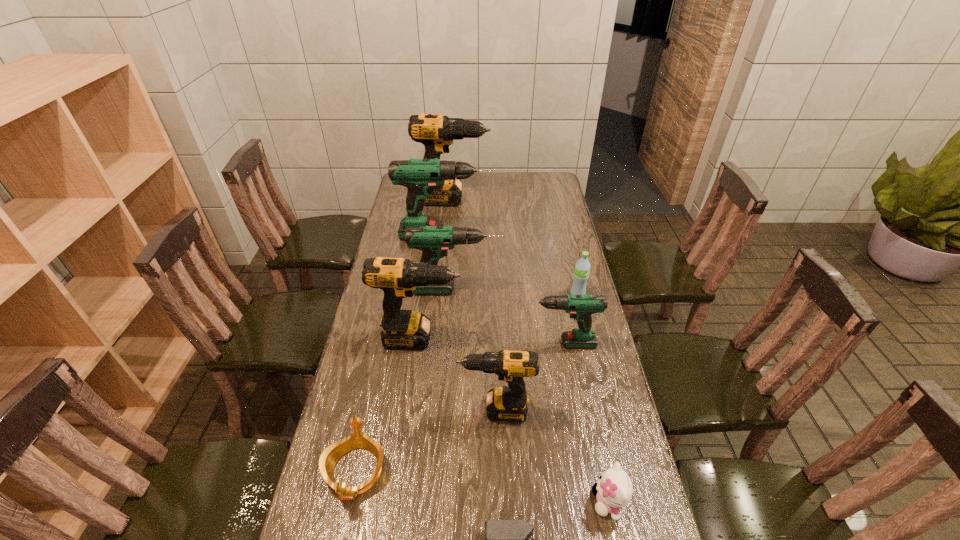
Identify the location of the shortest drill. (581, 307).

At what (x,y) coordinates should I click in order to perform the action: click on water bottle. Please return your answer as a coordinate pair (x, y). Looking at the image, I should click on (582, 267).

What are the coordinates of `white kitten` in the screenshot? It's located at (614, 489).

The width and height of the screenshot is (960, 540). What are the coordinates of `gold tiara` in the screenshot? It's located at (330, 456).

Where is `the ninth tallest object`? Image resolution: width=960 pixels, height=540 pixels. the ninth tallest object is located at coordinates (330, 456).

Identify the location of free space located at the tip of the farthest object. (516, 200).

This screenshot has width=960, height=540. Identify the location of vacant region located 0.150m on the handle side of the biggest green drill. (528, 235).

Find the location of `vacant space located 0.100m at the tip of the second nearest black drill`. vacant space located 0.100m at the tip of the second nearest black drill is located at coordinates [x=492, y=339].

Locate an element on the screen. vacant space located on the handle side of the second smallest green drill is located at coordinates [519, 290].

Identify the location of free space located 0.050m at the tip of the nearest black drill. (442, 410).